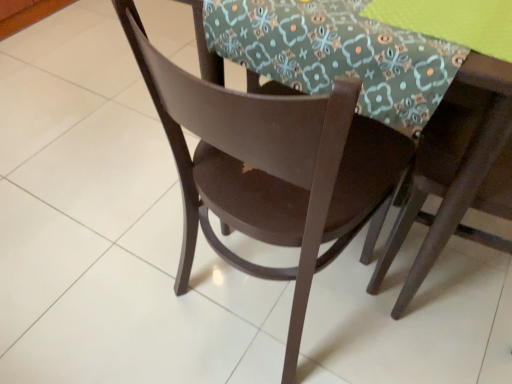
Question: From a real-world perspective, is matte brown chair at upper right, marked as the 2th chair in a left-to-right arrangement, beneath floral fabric at center?

Choices:
 (A) yes
 (B) no

Answer: (A)

Question: Is matte brown chair at upper right, marked as the 2th chair in a left-to-right arrangement, positioned behind floral fabric at center?

Choices:
 (A) yes
 (B) no

Answer: (B)

Question: Considering the relative sizes of matte brown chair at upper right, marked as the 2th chair in a left-to-right arrangement, and floral fabric at center in the image provided, is matte brown chair at upper right, marked as the 2th chair in a left-to-right arrangement, taller than floral fabric at center?

Choices:
 (A) no
 (B) yes

Answer: (B)

Question: Considering the relative sizes of matte brown chair at upper right, marked as the 2th chair in a left-to-right arrangement, and floral fabric at center in the image provided, is matte brown chair at upper right, marked as the 2th chair in a left-to-right arrangement, smaller than floral fabric at center?

Choices:
 (A) yes
 (B) no

Answer: (B)

Question: From the image's perspective, is matte brown chair at upper right, the first chair when ordered from right to left, on floral fabric at center?

Choices:
 (A) yes
 (B) no

Answer: (B)

Question: Is matte brown chair at upper right, the first chair when ordered from right to left, to the left of floral fabric at center from the viewer's perspective?

Choices:
 (A) no
 (B) yes

Answer: (A)

Question: Is matte brown chair at upper right, the first chair when ordered from right to left, positioned behind matte brown table at center?

Choices:
 (A) yes
 (B) no

Answer: (B)

Question: Can you confirm if matte brown chair at upper right, marked as the 2th chair in a left-to-right arrangement, is taller than matte brown table at center?

Choices:
 (A) no
 (B) yes

Answer: (B)

Question: From the image's perspective, is matte brown chair at upper right, the first chair when ordered from right to left, over matte brown table at center?

Choices:
 (A) yes
 (B) no

Answer: (B)

Question: Is matte brown chair at upper right, the first chair when ordered from right to left, to the left of matte brown table at center from the viewer's perspective?

Choices:
 (A) yes
 (B) no

Answer: (B)

Question: Is matte brown chair at upper right, the first chair when ordered from right to left, positioned beyond the bounds of matte brown table at center?

Choices:
 (A) yes
 (B) no

Answer: (B)

Question: From the image's perspective, is matte brown chair at upper right, marked as the 2th chair in a left-to-right arrangement, under matte brown table at center?

Choices:
 (A) no
 (B) yes

Answer: (B)

Question: From a real-world perspective, does matte brown table at center stand above matte brown chair at center, which is the 2th chair from right to left?

Choices:
 (A) yes
 (B) no

Answer: (B)